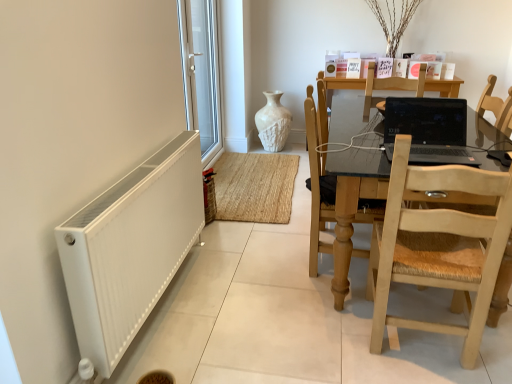
Where is `free location to the left of light wood/rattan chair at right, the first chair viewed from the front`? free location to the left of light wood/rattan chair at right, the first chair viewed from the front is located at coordinates (328, 332).